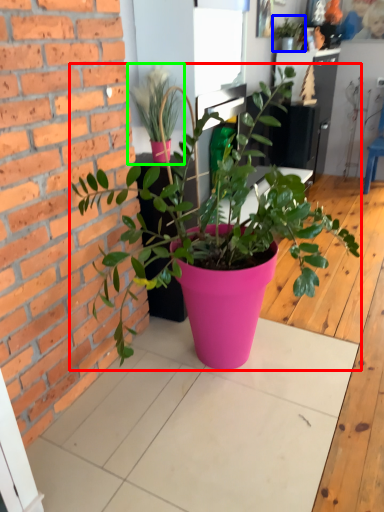
Question: Based on their relative distances, which object is nearer to houseplant (highlighted by a red box)? Choose from houseplant (highlighted by a blue box) and houseplant (highlighted by a green box).

Choices:
 (A) houseplant
 (B) houseplant

Answer: (B)